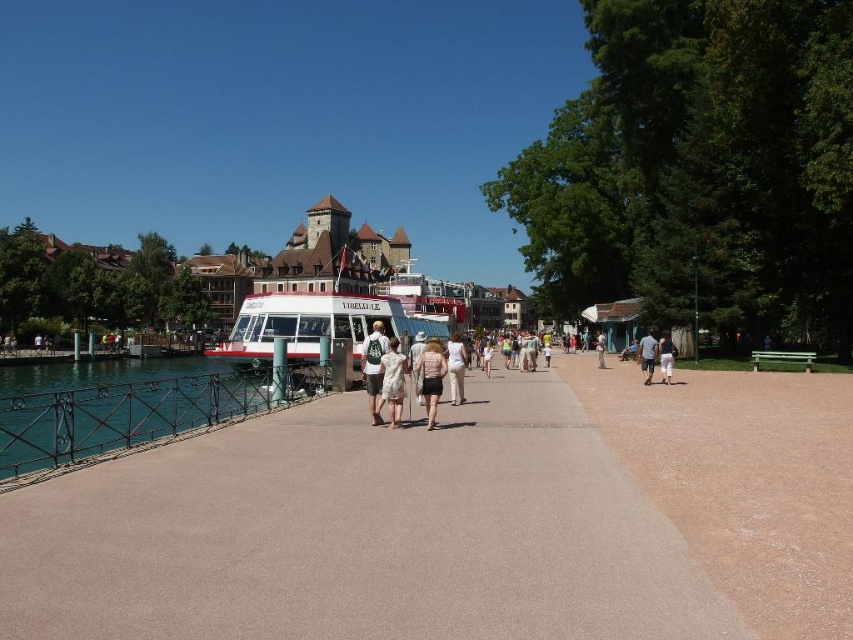
Based on the photo, you are standing at the point labeled point (604,336) and want to walk to the point labeled point (328,330). Given that the distance between these two points is 10 meters, and you can walk at a speed of 1.5 meters per second, how many seconds will it take you to reach your destination?

The distance between point (328,330) and point (604,336) is 10 meters. At a walking speed of 1.5 meters per second, it would take approximately 6.67 seconds to reach the destination.

You are a photographer setting up a shoot on the riverside promenade. You have two outfits to photograph against the scenic backdrop. The floral dress at center and the light brown leather jacket at center are both placed on a mannequin stand. Since you want to highlight the slimming effect of the floral dress, which outfit should you choose to emphasize a narrower silhouette?

The floral dress at center is thinner than the light brown leather jacket at center, so to emphasize a narrower silhouette, you should choose the floral dress at center for the shoot.